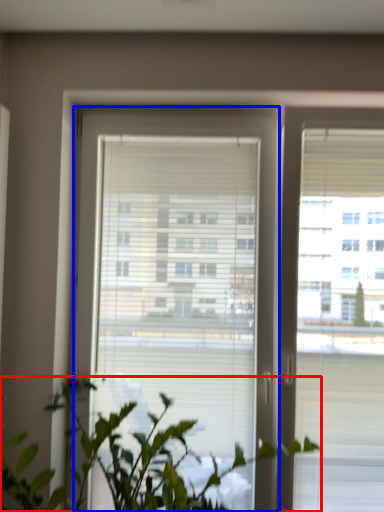
Question: Which of the following is the closest to the observer, houseplant (highlighted by a red box) or window (highlighted by a blue box)?

Choices:
 (A) houseplant
 (B) window

Answer: (A)